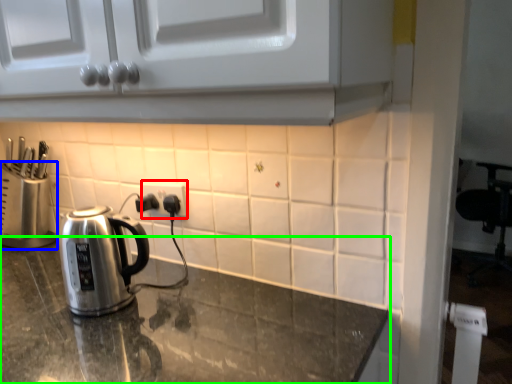
Question: Which object is the farthest from electric outlet (highlighted by a red box)? Choose among these: appliance (highlighted by a blue box) or countertop (highlighted by a green box).

Choices:
 (A) appliance
 (B) countertop

Answer: (A)